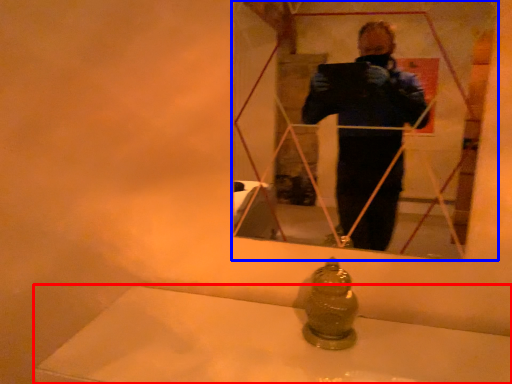
Question: Which object appears closest to the camera in this image, bath (highlighted by a red box) or mirror (highlighted by a blue box)?

Choices:
 (A) bath
 (B) mirror

Answer: (A)